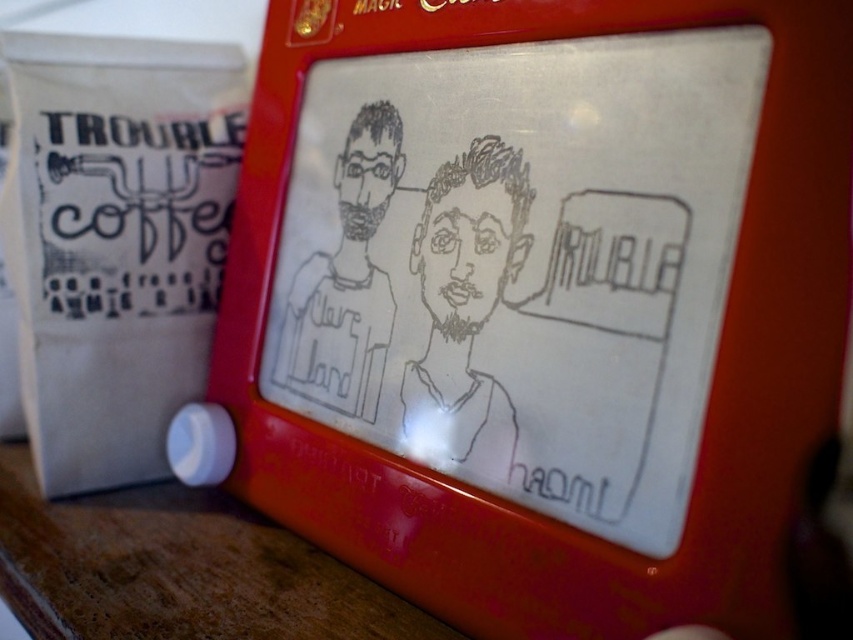
Which of these two, black line drawing face at center or black ink drawing of man at center, stands taller?

With more height is black ink drawing of man at center.

Does point (431, 406) come in front of point (328, 268)?

That is True.

Does point (459, 321) come in front of point (376, 209)?

Yes, it is in front of point (376, 209).

Find the location of a particular element. This screenshot has height=640, width=853. black line drawing face at center is located at coordinates (463, 305).